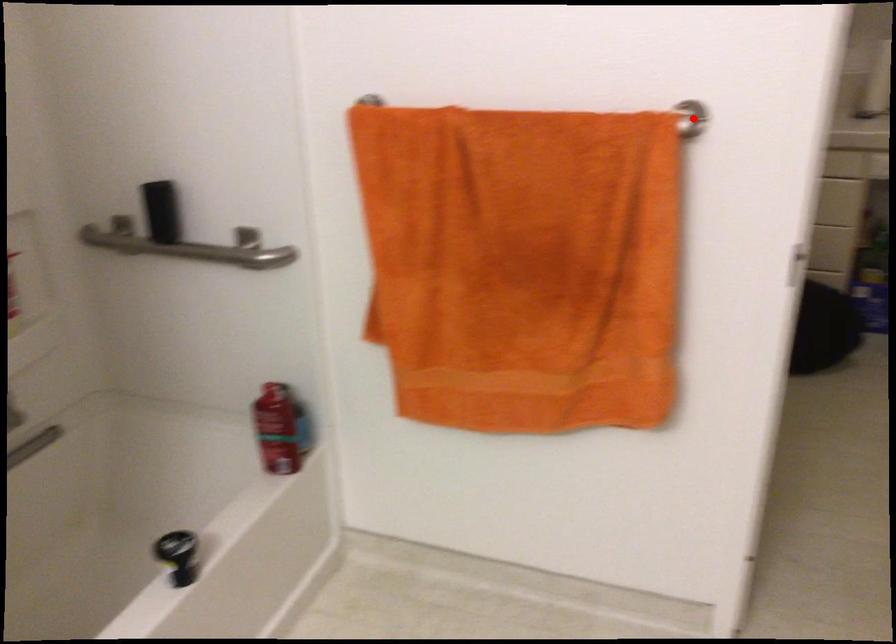
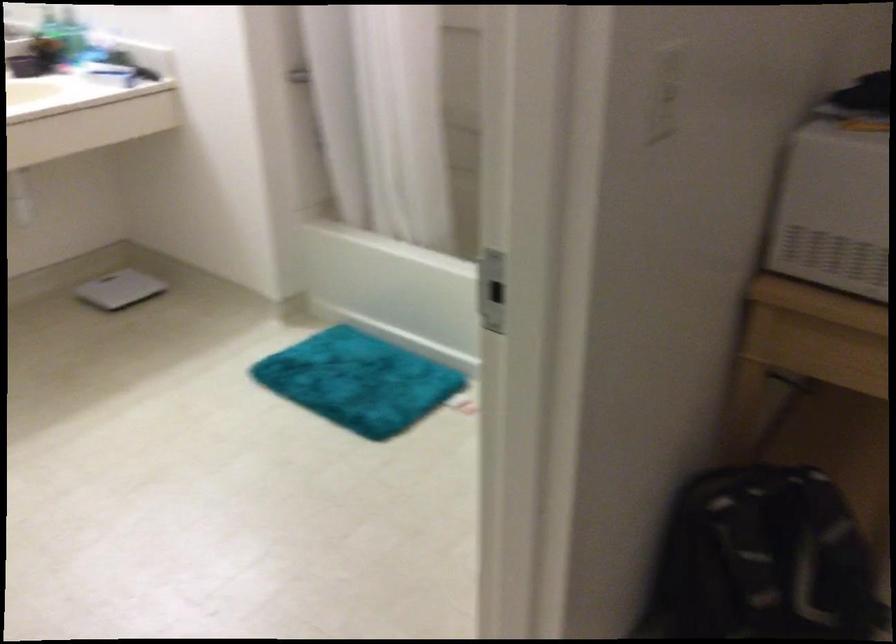
Question: I am providing you with two images of the same scene from different viewpoints. In image1, a red point is highlighted. Considering the same 3D point in image2, which of the following is correct?

Choices:
 (A) It is closer
 (B) It is farther

Answer: (A)